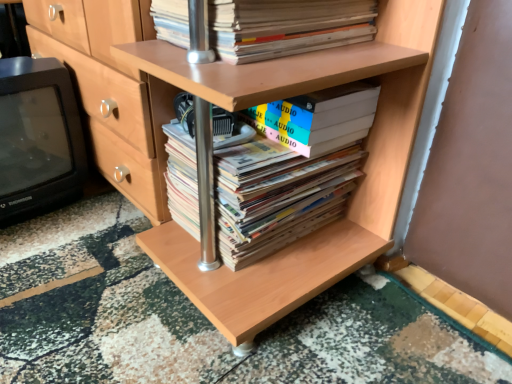
Question: In terms of size, does matte cardboard book at upper center, which is counted as the 3th book, starting from the bottom, appear bigger or smaller than black plastic television at left?

Choices:
 (A) small
 (B) big

Answer: (A)

Question: In terms of width, does matte cardboard book at upper center, which is counted as the 3th book, starting from the bottom, look wider or thinner when compared to black plastic television at left?

Choices:
 (A) thin
 (B) wide

Answer: (A)

Question: Estimate the real-world distances between objects in this image. Which object is farther from the matte cardboard book at upper center, which ranks as the 1th book in top-to-bottom order?

Choices:
 (A) black plastic television at left
 (B) hardcover books at center, which is the 3th book from top to bottom
 (C) white matte book at center, the second book from the bottom

Answer: (A)

Question: Estimate the real-world distances between objects in this image. Which object is farther from the matte cardboard book at upper center, which is counted as the 3th book, starting from the bottom?

Choices:
 (A) black plastic television at left
 (B) hardcover books at center, the 1th book when ordered from bottom to top
 (C) white matte book at center, the second book from the bottom

Answer: (A)